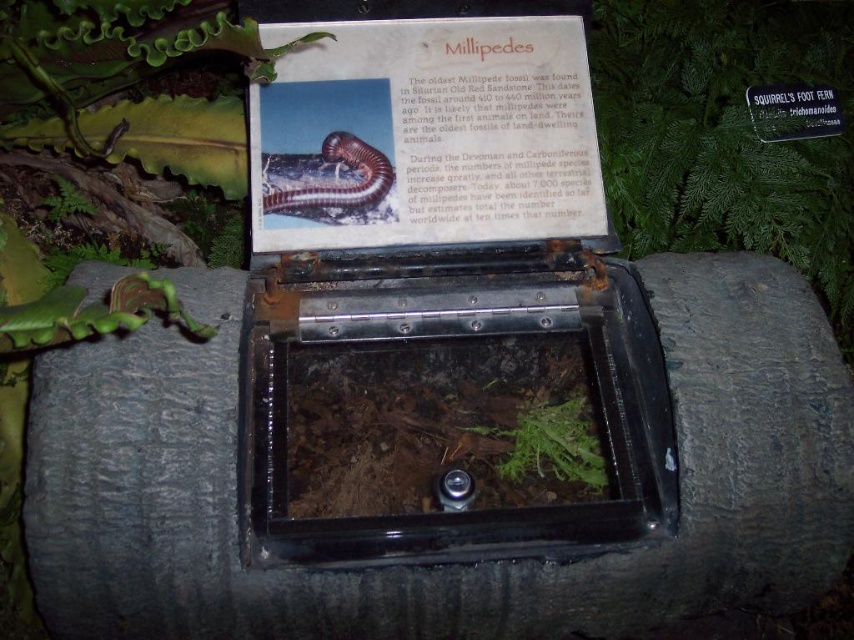
Can you confirm if green leafy fern at upper center is shorter than green leafy plant at center?

No.

Locate an element on the screen. The height and width of the screenshot is (640, 854). green leafy fern at upper center is located at coordinates (726, 132).

Is point (605, 8) positioned in front of point (69, 184)?

No, (605, 8) is further to viewer.

Who is higher up, green leafy fern at upper center or green leafy plant at lower left?

green leafy fern at upper center is higher up.

Does point (652, 67) come behind point (92, 205)?

Yes, point (652, 67) is behind point (92, 205).

You are a GUI agent. You are given a task and a screenshot of the screen. Output one action in this format:
    pyautogui.click(x=<x>, y=<y>)
    Task: Click on the green leafy fern at upper center
    
    Given the screenshot: What is the action you would take?
    pyautogui.click(x=726, y=132)

Does green leafy plant at center appear on the left side of green leafy plant at lower left?

Incorrect, green leafy plant at center is not on the left side of green leafy plant at lower left.

Between point (560, 428) and point (53, 177), which one is positioned in front?

Point (560, 428) is in front.

Find the location of `green leafy plant at center`. green leafy plant at center is located at coordinates (551, 442).

Image resolution: width=854 pixels, height=640 pixels. I want to click on green leafy plant at center, so click(x=551, y=442).